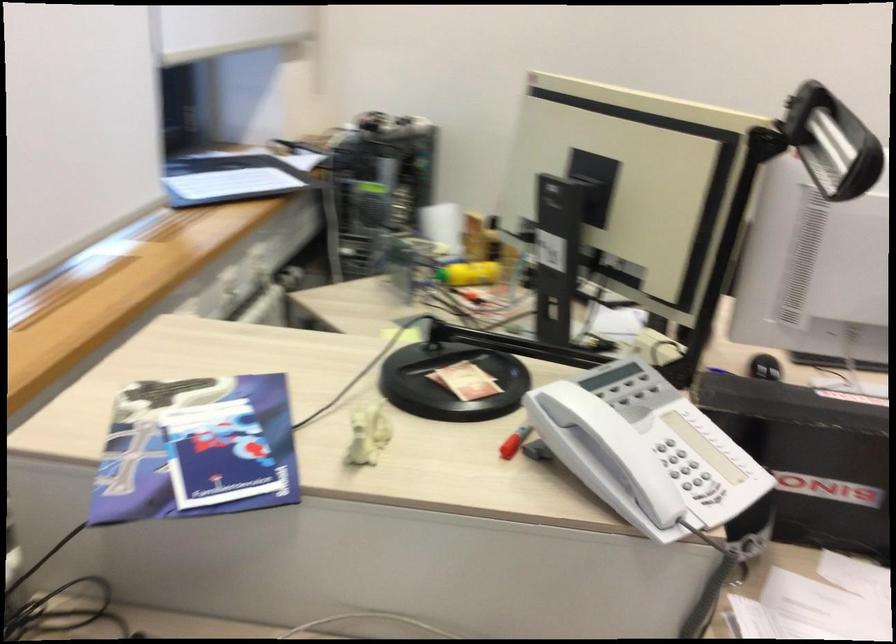
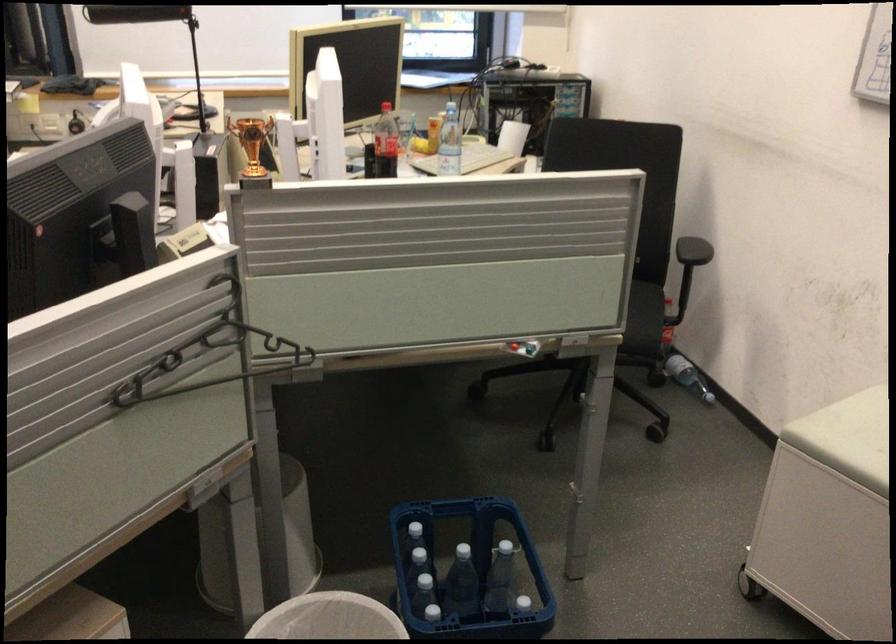
Question: I am providing you with two images of the same scene from different viewpoints. After the viewpoint changes to image2, which objects are now occluded?

Choices:
 (A) purple brochure
 (B) red button
 (C) brown leather seat
 (D) white trash can

Answer: (A)